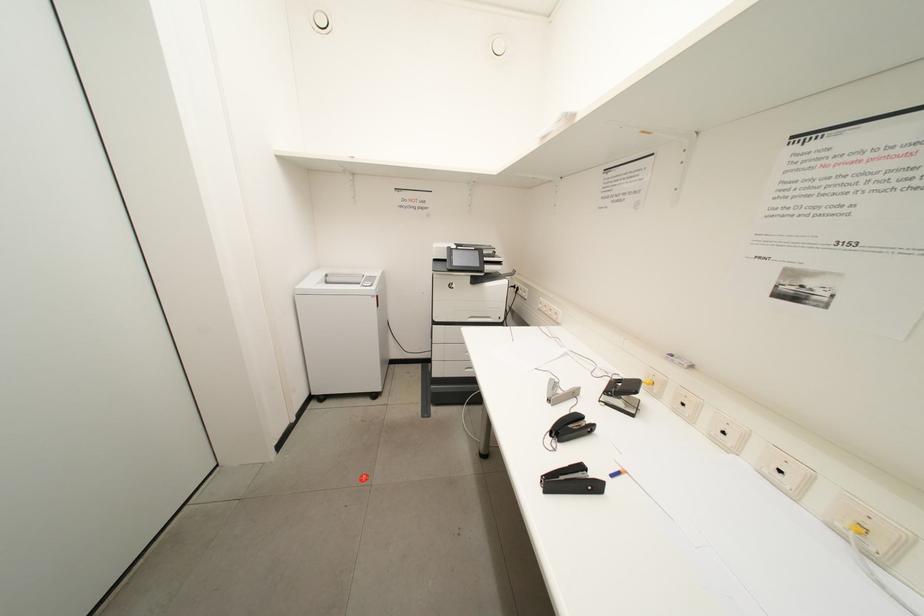
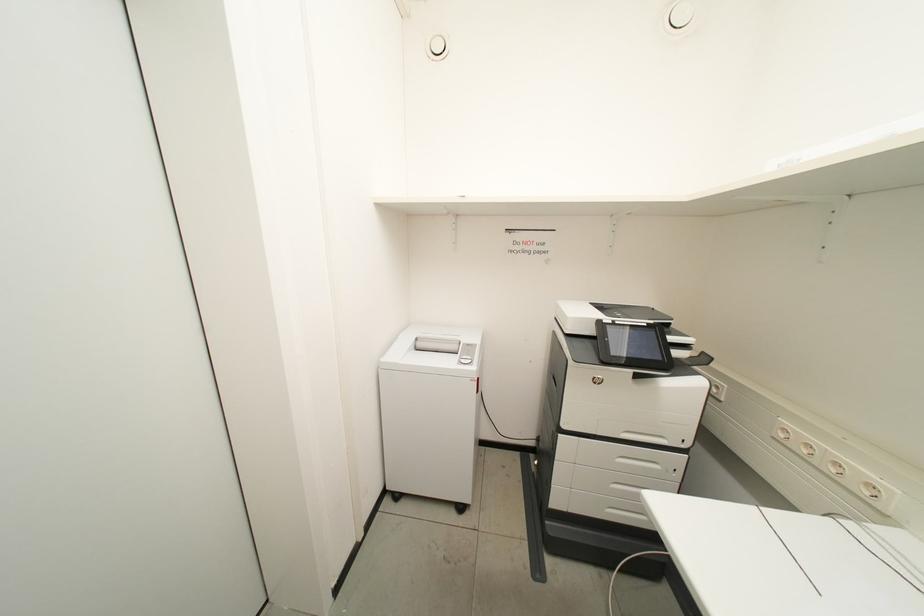
Question: The camera is either moving clockwise (left) or counter-clockwise (right) around the object. The first image is from the beginning of the video and the second image is from the end. Is the camera moving left or right when shooting the video?

Choices:
 (A) Left
 (B) Right

Answer: (B)